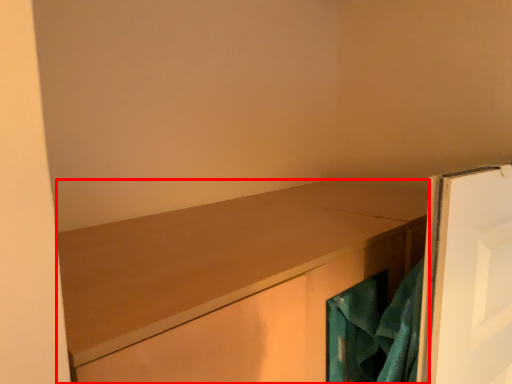
Question: From the image's perspective, where is cabinetry (annotated by the red box) located in relation to laundry in the image?

Choices:
 (A) above
 (B) below

Answer: (B)